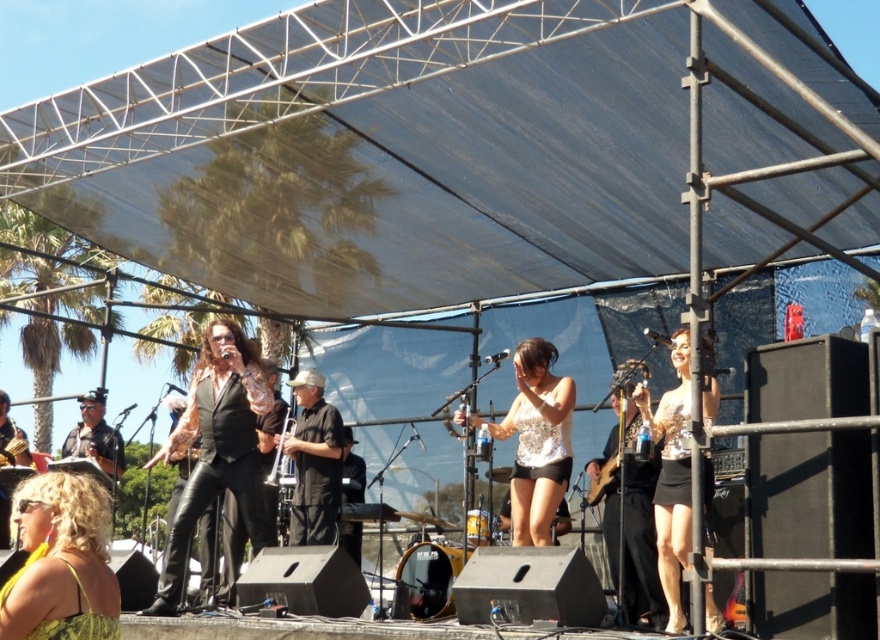
Is point (515, 477) in front of point (672, 451)?

No.

Who is positioned more to the right, sparkly silver top at center or silver sequined dress at center?

From the viewer's perspective, silver sequined dress at center appears more on the right side.

Which is behind, point (562, 429) or point (676, 332)?

The point (562, 429) is behind.

You are a GUI agent. You are given a task and a screenshot of the screen. Output one action in this format:
    pyautogui.click(x=<x>, y=<y>)
    Task: Click on the sparkly silver top at center
    
    Given the screenshot: What is the action you would take?
    pyautogui.click(x=534, y=440)

Which of these two, yellow-green fabric dress at lower left or black matte shirt at center, stands shorter?

yellow-green fabric dress at lower left is shorter.

Is point (94, 563) farther from viewer compared to point (331, 428)?

No, (94, 563) is closer to viewer.

Locate an element on the screen. yellow-green fabric dress at lower left is located at coordinates (61, 563).

Measure the distance from metallic gold guitar at center to silver metallic trumpet at center.

A distance of 3.32 meters exists between metallic gold guitar at center and silver metallic trumpet at center.

Is metallic gold guitar at center behind silver metallic trumpet at center?

No, metallic gold guitar at center is in front of silver metallic trumpet at center.

At what (x,y) coordinates should I click in order to perform the action: click on metallic gold guitar at center. Please return your answer as a coordinate pair (x, y). Looking at the image, I should click on point(607,465).

What are the coordinates of `metallic gold guitar at center` in the screenshot? It's located at (607, 465).